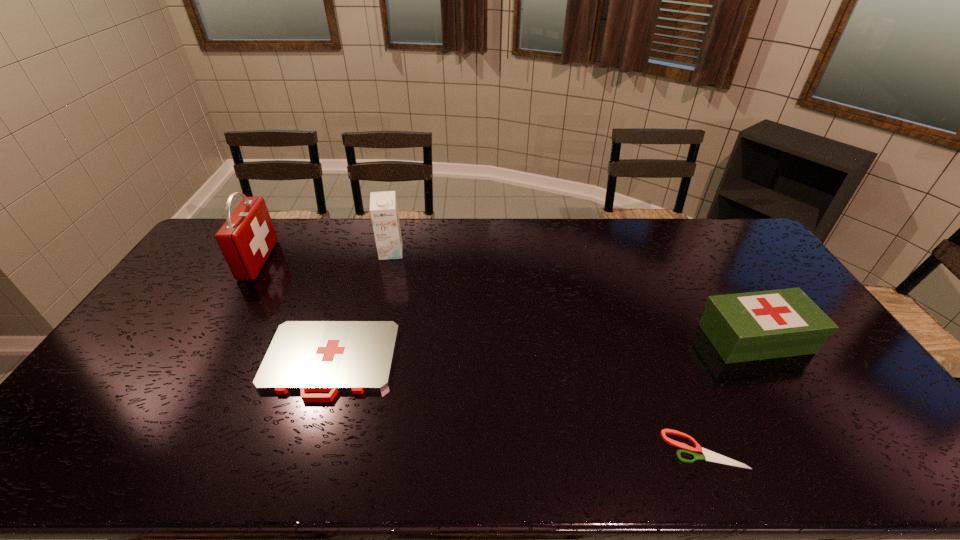
Locate an element on the screen. The height and width of the screenshot is (540, 960). vacant area between the tallest first-aid kit and the scissors is located at coordinates point(481,355).

The image size is (960, 540). In order to click on vacant space that's between the fourth shortest object and the tallest first-aid kit in this screenshot , I will do `click(324, 256)`.

Locate an element on the screen. The height and width of the screenshot is (540, 960). object that ranks as the second closest to the leftmost first-aid kit is located at coordinates [383, 205].

Where is `the second closest object to the third tallest object`? the second closest object to the third tallest object is located at coordinates [x=304, y=356].

Point out which first-aid kit is positioned as the nearest to the leftmost object. Please provide its 2D coordinates. Your answer should be formatted as a tuple, i.e. [(x, y)], where the tuple contains the x and y coordinates of a point satisfying the conditions above.

[(304, 356)]

Locate an element on the screen. the first-aid kit that is the closest to the second tallest object is located at coordinates (304, 356).

At what (x,y) coordinates should I click in order to perform the action: click on free region that satisfies the following two spatial constraints: 1. on the front face of the tallest first-aid kit; 2. on the left side of the third shortest object. Please return your answer as a coordinate pair (x, y). The height and width of the screenshot is (540, 960). Looking at the image, I should click on (211, 339).

Locate an element on the screen. This screenshot has height=540, width=960. vacant space that satisfies the following two spatial constraints: 1. on the front side of the fourth object from left to right; 2. on the right side of the second tallest object is located at coordinates (343, 449).

This screenshot has height=540, width=960. I want to click on vacant space that satisfies the following two spatial constraints: 1. on handle side the second first-aid kit from left to right; 2. on the left side of the nearest object, so click(302, 449).

What are the coordinates of `vacant region that satisfies the following two spatial constraints: 1. on the front side of the shortest object; 2. on the left side of the carton` in the screenshot? It's located at (343, 449).